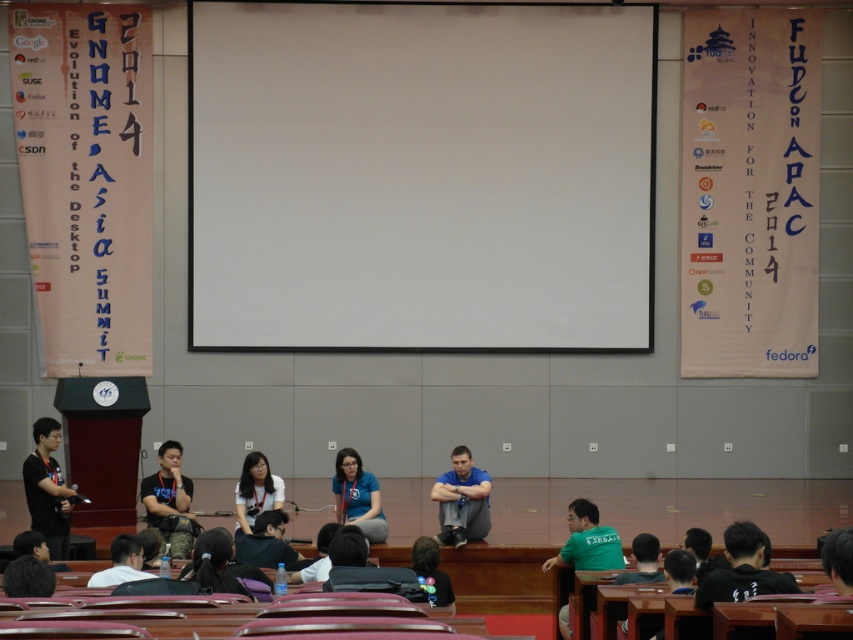
Based on the photo, you are an event organizer at the GNOME Asia Summit 2014 and FUDCon APAC 2014. You need to set up a camera to capture both the white matte projection screen at center and the black matte shirt at lower right. Which object should the camera focus on first to ensure both are in frame?

The camera should focus on the black matte shirt at lower right first because the white matte projection screen at center is smaller in size compared to the black matte shirt at lower right, ensuring both fit within the frame by prioritizing the larger object.

You are an event photographer at the GNOME Asia Summit 2014 and FUDCon APAC 2014. You need to capture a closeup shot of both the black matte shirt at left and the green matte shirt at lower right. Since you can only focus on one shirt at a time, which shirt should you focus on to ensure the other remains in the background but still visible? Explain your choice based on their sizes.

The black matte shirt at left is larger in size compared to the green matte shirt at lower right. To ensure both are visible with one in focus and the other in the background, focus on the larger black matte shirt at left. This way, the smaller green matte shirt at lower right will still be in the frame and recognizable despite being out of focus.